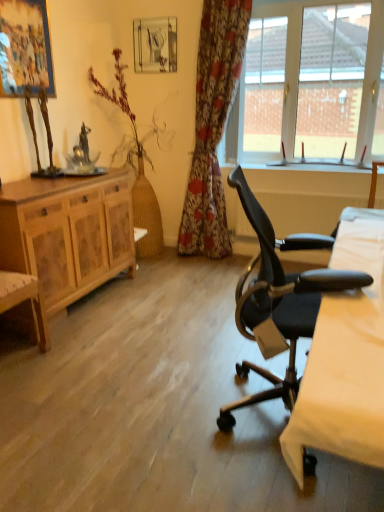
The image size is (384, 512). Find the location of `free location in front of floral fabric curtain at center`. free location in front of floral fabric curtain at center is located at coordinates (204, 274).